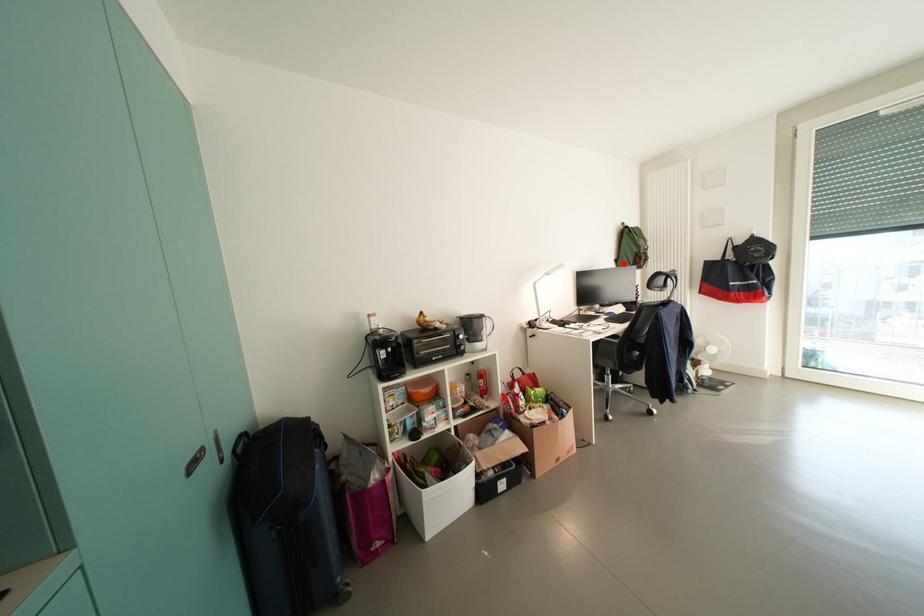
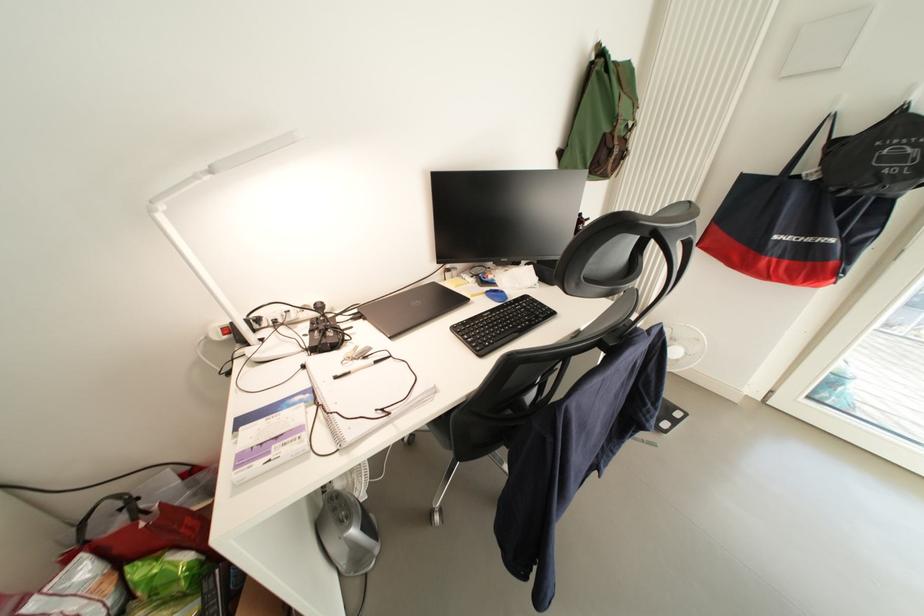
Find the pixel in the second image that matches the highlighted location in the first image.

(568, 156)